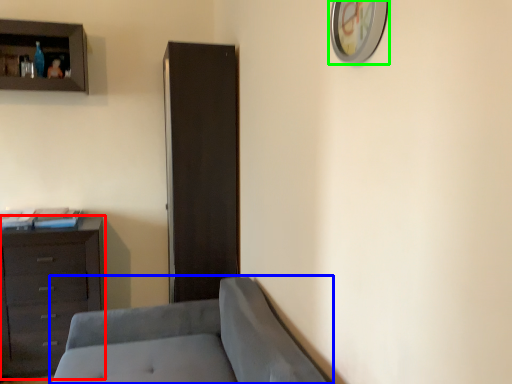
Question: Which object is positioned closest to chest of drawers (highlighted by a red box)? Select from studio couch (highlighted by a blue box) and picture frame (highlighted by a green box).

Choices:
 (A) studio couch
 (B) picture frame

Answer: (A)